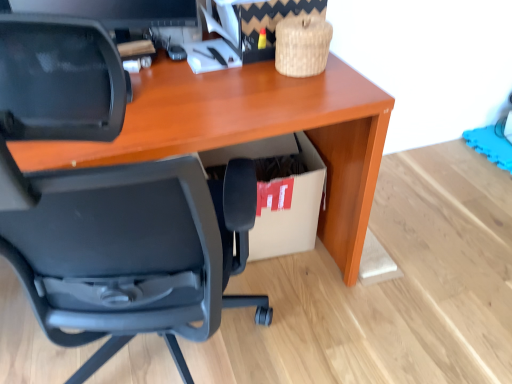
Question: Could you tell me if black plastic chair at lower left is facing cardboard box at lower right?

Choices:
 (A) no
 (B) yes

Answer: (B)

Question: Does black plastic chair at lower left have a larger size compared to cardboard box at lower right?

Choices:
 (A) yes
 (B) no

Answer: (A)

Question: Does black plastic chair at lower left come behind cardboard box at lower right?

Choices:
 (A) yes
 (B) no

Answer: (B)

Question: Considering the relative sizes of black plastic chair at lower left and cardboard box at lower right in the image provided, is black plastic chair at lower left thinner than cardboard box at lower right?

Choices:
 (A) no
 (B) yes

Answer: (A)

Question: From a real-world perspective, is black plastic chair at lower left located higher than cardboard box at lower right?

Choices:
 (A) no
 (B) yes

Answer: (B)

Question: From the image's perspective, is black plastic chair at lower left located above cardboard box at lower right?

Choices:
 (A) no
 (B) yes

Answer: (A)

Question: Is cardboard box at lower right directly adjacent to black plastic chair at lower left?

Choices:
 (A) no
 (B) yes

Answer: (A)

Question: From the image's perspective, is cardboard box at lower right beneath black plastic chair at lower left?

Choices:
 (A) yes
 (B) no

Answer: (B)

Question: Can you confirm if cardboard box at lower right is thinner than black plastic chair at lower left?

Choices:
 (A) no
 (B) yes

Answer: (B)

Question: Is cardboard box at lower right wider than black plastic chair at lower left?

Choices:
 (A) yes
 (B) no

Answer: (B)

Question: Is cardboard box at lower right positioned far away from black plastic chair at lower left?

Choices:
 (A) no
 (B) yes

Answer: (A)

Question: Considering the relative sizes of cardboard box at lower right and black plastic chair at lower left in the image provided, is cardboard box at lower right bigger than black plastic chair at lower left?

Choices:
 (A) yes
 (B) no

Answer: (B)

Question: Relative to black plastic chair at lower left, is cardboard box at lower right in front or behind?

Choices:
 (A) behind
 (B) front

Answer: (A)